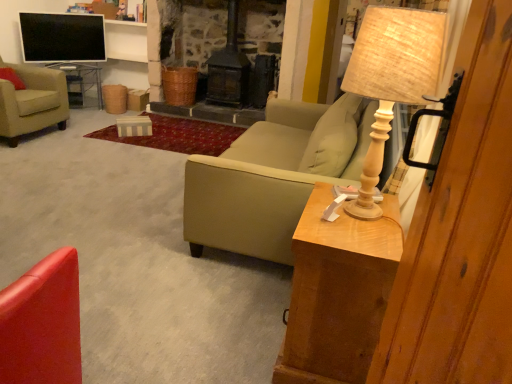
I want to click on vacant space situated on the left part of suede green couch at center, so click(x=109, y=190).